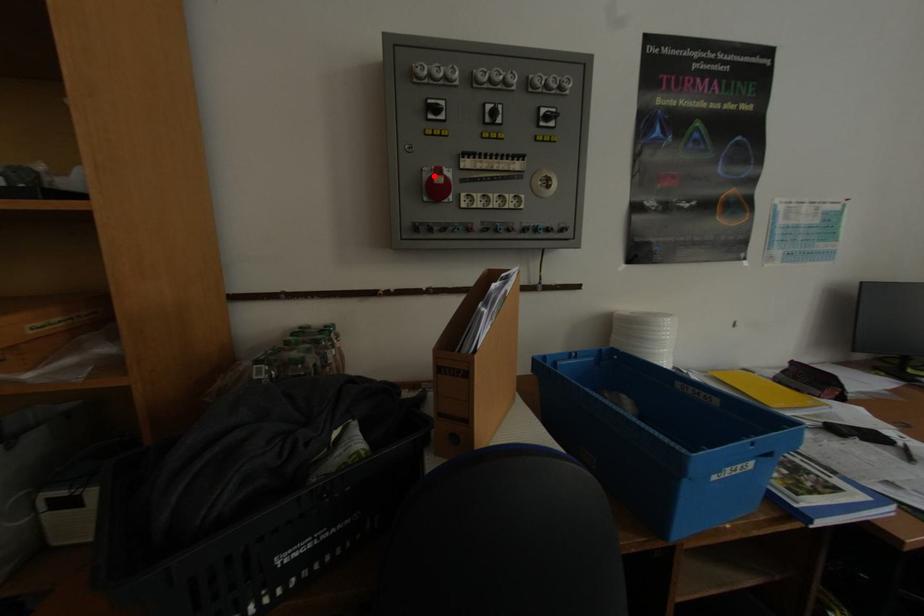
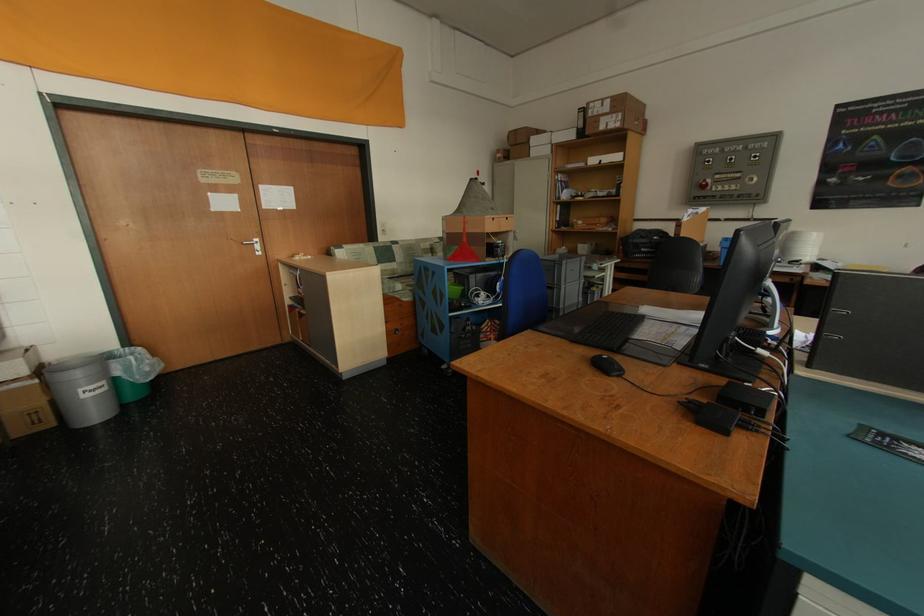
Where in the second image is the point corresponding to the highlighted location from the first image?

(709, 183)